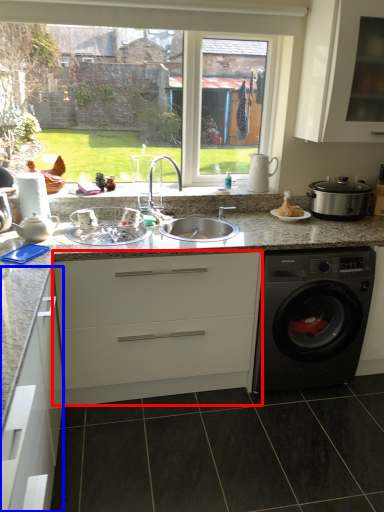
Question: Which object appears farthest to the camera in this image, cabinetry (highlighted by a red box) or cabinetry (highlighted by a blue box)?

Choices:
 (A) cabinetry
 (B) cabinetry

Answer: (A)